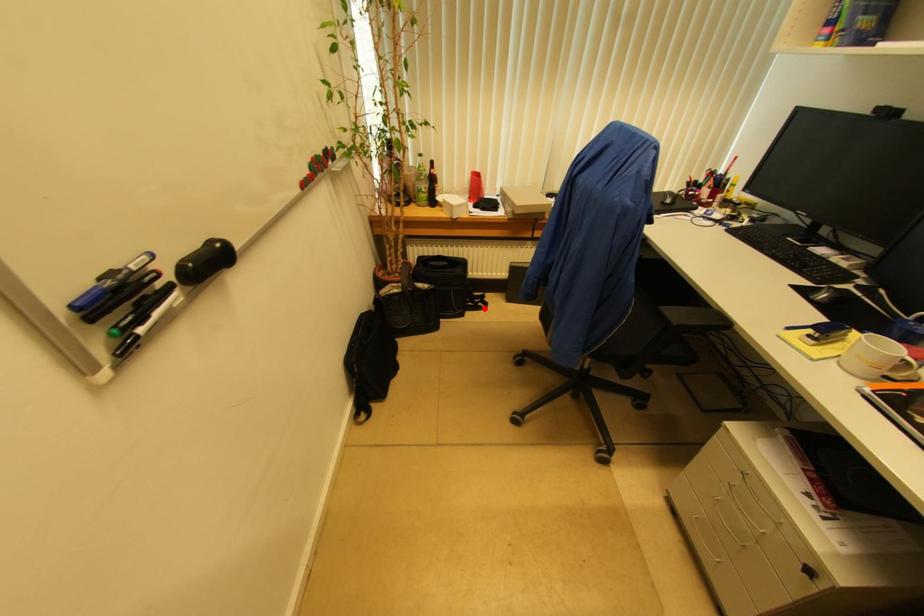
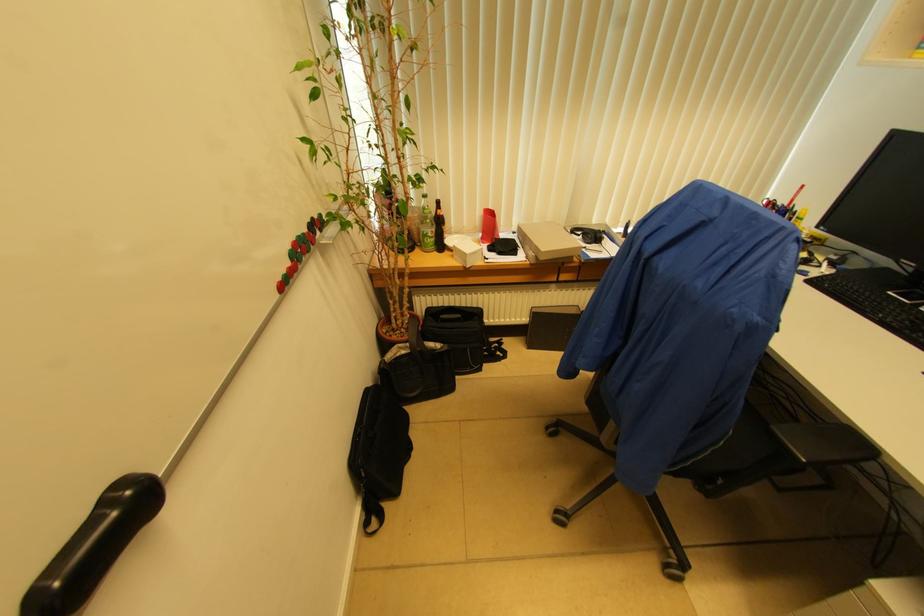
Question: I am providing you with two images of the same scene from different viewpoints. A red point is shown in image1. For the corresponding object point in image2, is it positioned nearer or farther from the camera?

Choices:
 (A) Nearer
 (B) Farther

Answer: (B)